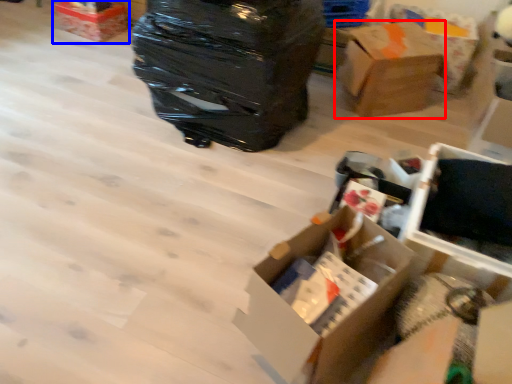
Question: Which of the following is the closest to the observer, box (highlighted by a red box) or box (highlighted by a blue box)?

Choices:
 (A) box
 (B) box

Answer: (A)